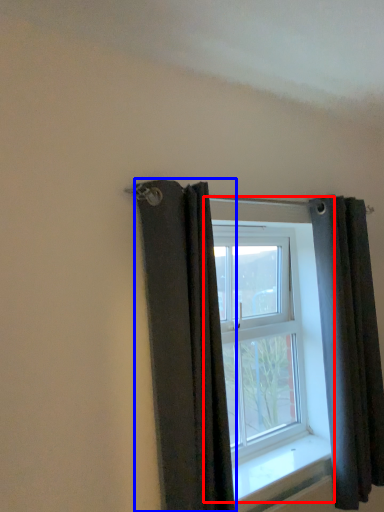
Question: Which object appears farthest to the camera in this image, window (highlighted by a red box) or curtain (highlighted by a blue box)?

Choices:
 (A) window
 (B) curtain

Answer: (A)